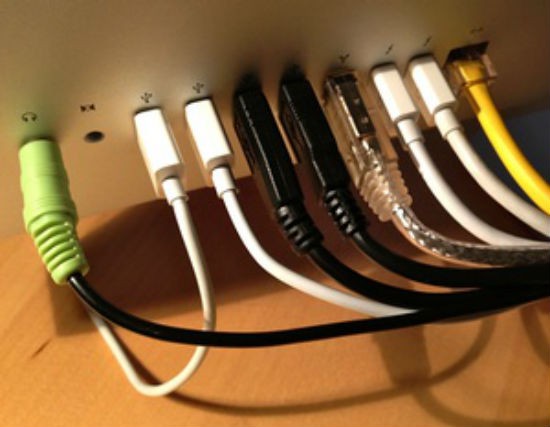
Identify the location of cables to the left of center. The height and width of the screenshot is (427, 550). (255, 135), (202, 136), (153, 154), (51, 203).